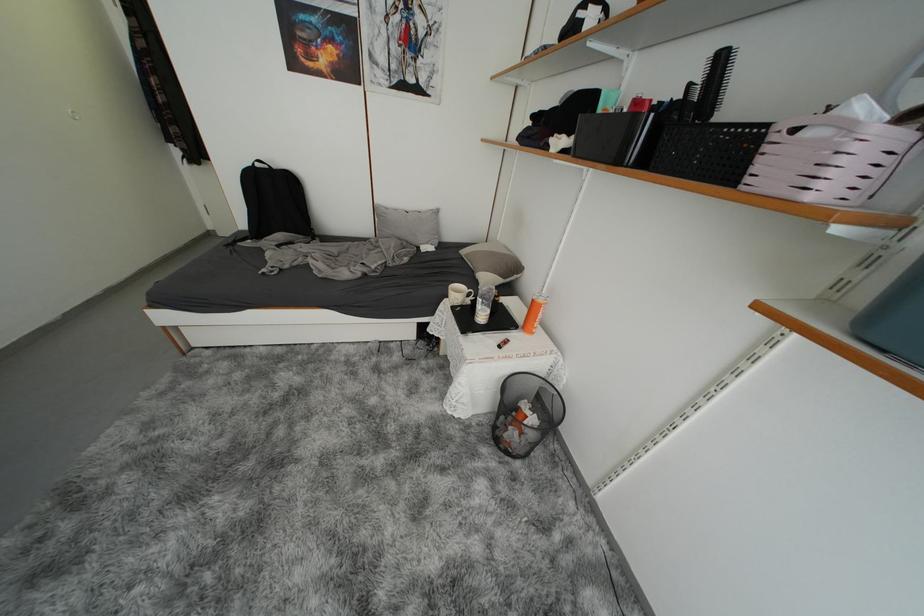
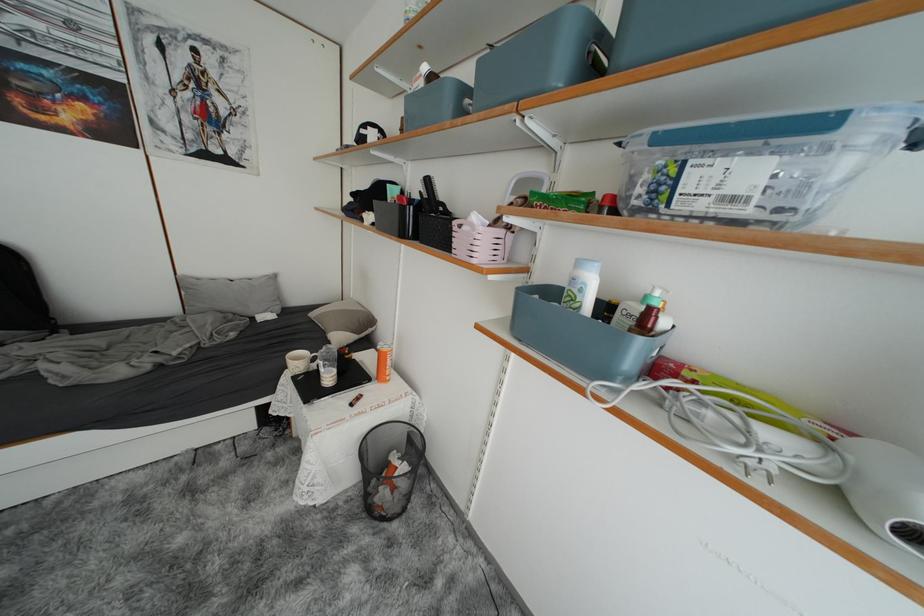
Question: I am providing you with two images of the same scene from different viewpoints. Which of the following objects are not visible in image2?

Choices:
 (A) lotion bottle pump
 (B) blue storage box handle
 (C) black bottle
 (D) none of these

Answer: (D)